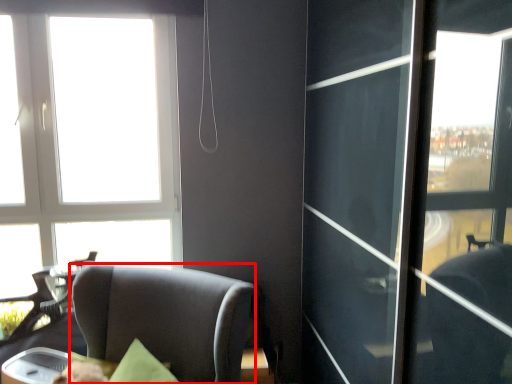
Question: Observing the image, what is the correct spatial positioning of chair (annotated by the red box) in reference to window?

Choices:
 (A) left
 (B) right

Answer: (B)